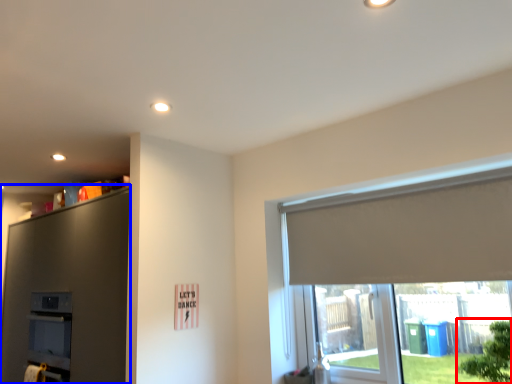
Question: Which point is closer to the camera, tree (highlighted by a red box) or dresser (highlighted by a blue box)?

Choices:
 (A) tree
 (B) dresser

Answer: (A)